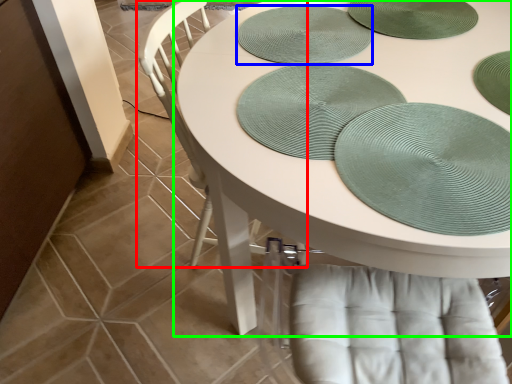
Question: Which object is the farthest from chair (highlighted by a red box)? Choose among these: platter (highlighted by a blue box) or table (highlighted by a green box).

Choices:
 (A) platter
 (B) table

Answer: (A)